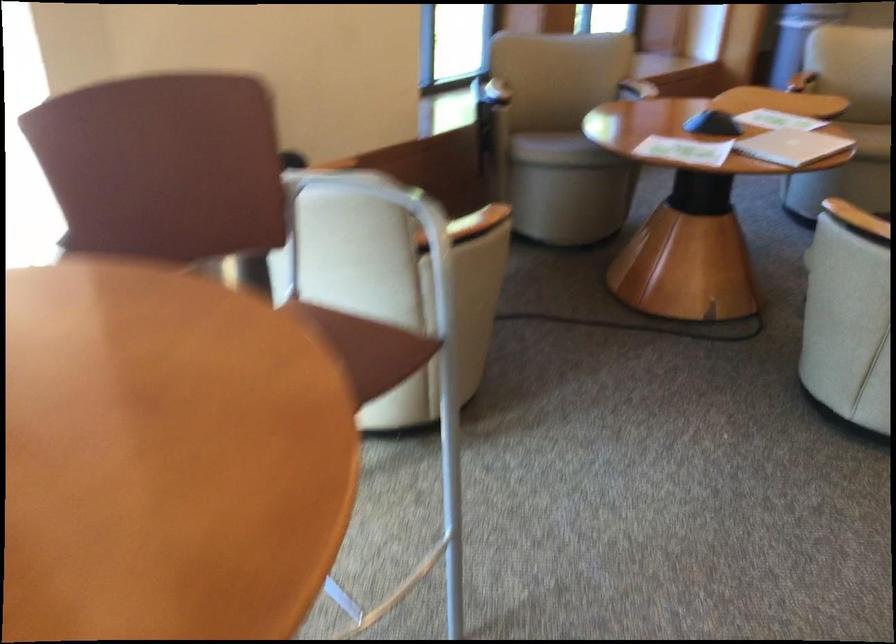
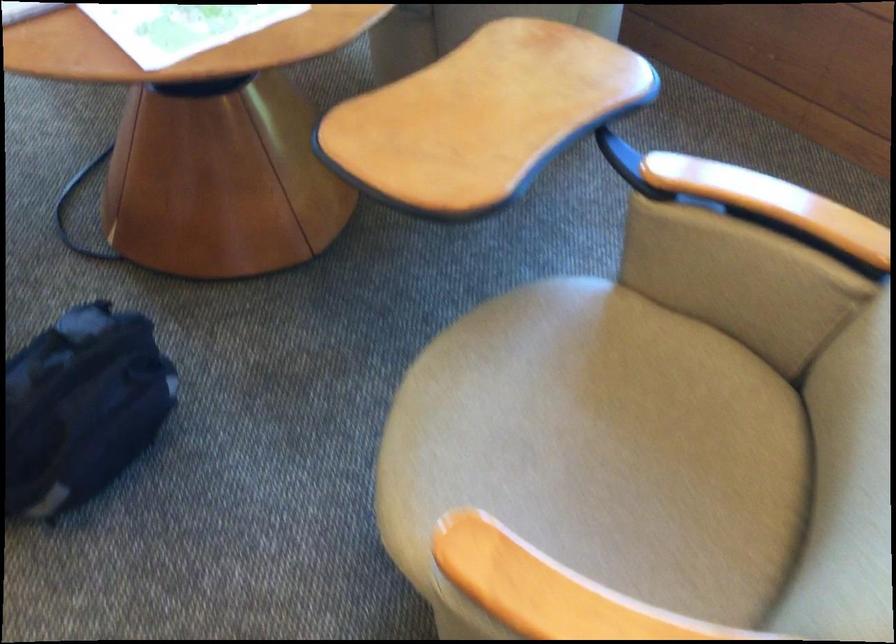
The point at (x=750, y=84) is marked in the first image. Where is the corresponding point in the second image?

(483, 116)